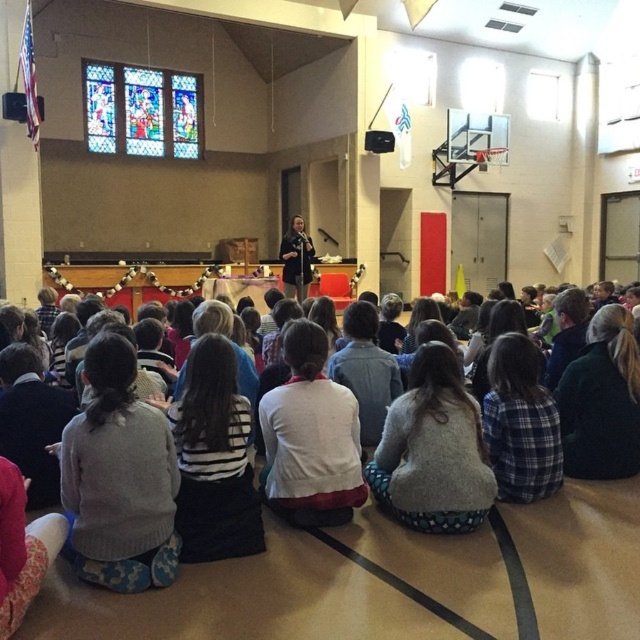
Does white soft sweater at center have a greater height compared to dark green sweater at lower right?

No, white soft sweater at center is not taller than dark green sweater at lower right.

Which is in front, point (276, 410) or point (563, 428)?

Point (276, 410)

Identify the location of white soft sweater at center. (310, 436).

Where is `white soft sweater at center`? The image size is (640, 640). white soft sweater at center is located at coordinates (310, 436).

Is point (332, 401) less distant than point (552, 356)?

Yes.

Who is more forward, (342, 515) or (579, 337)?

Point (342, 515) is in front.

This screenshot has height=640, width=640. Find the location of `white soft sweater at center`. white soft sweater at center is located at coordinates (310, 436).

Is white soft sweater at center in front of plaid fabric shirt at lower right?

That is True.

Does white soft sweater at center have a lesser height compared to plaid fabric shirt at lower right?

In fact, white soft sweater at center may be taller than plaid fabric shirt at lower right.

Where is `white soft sweater at center`? The width and height of the screenshot is (640, 640). white soft sweater at center is located at coordinates pos(310,436).

I want to click on white soft sweater at center, so click(x=310, y=436).